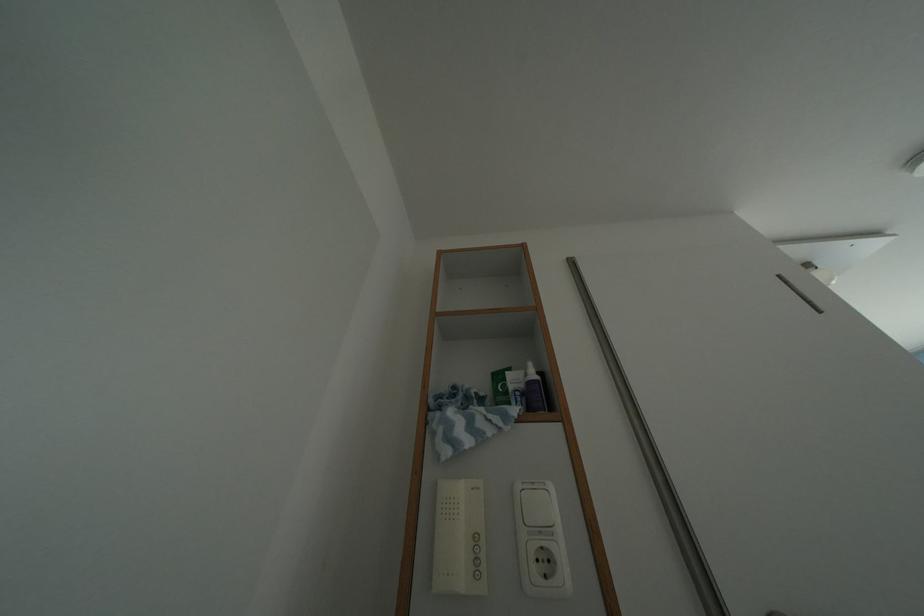
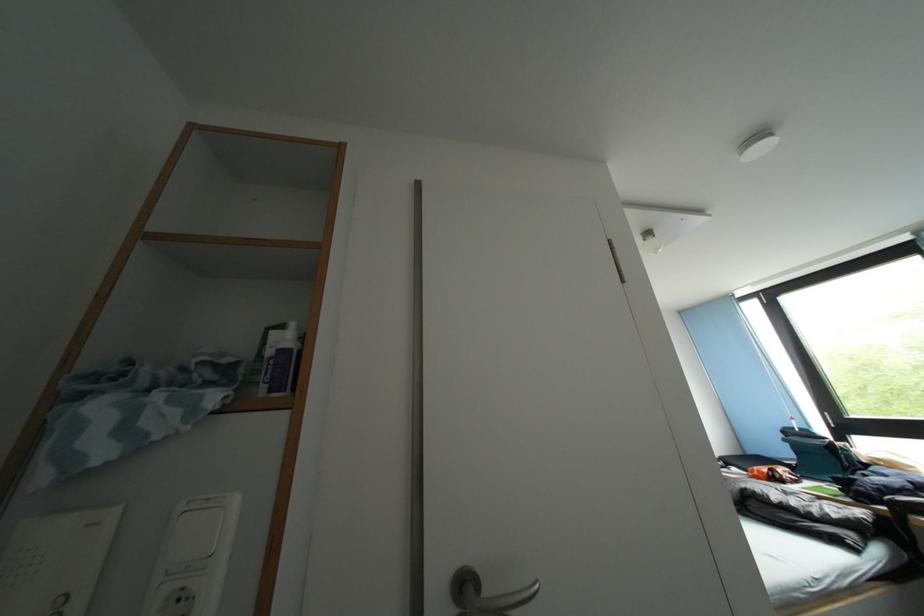
In the scene shown: How did the camera likely rotate?

The camera's rotation is toward right-down.